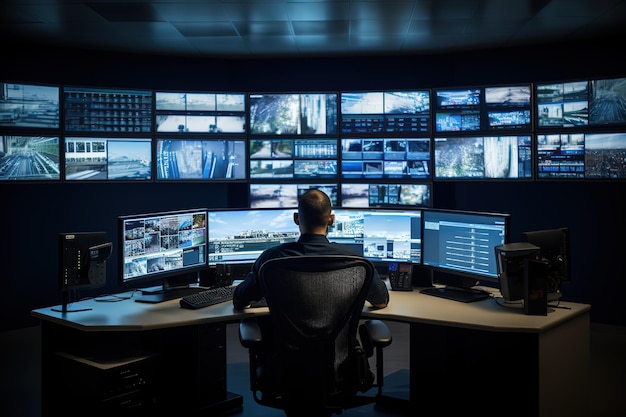
Identify the location of video screen in the top row. (26, 97), (168, 114), (284, 118), (371, 116), (454, 118), (511, 113), (567, 109), (616, 106).